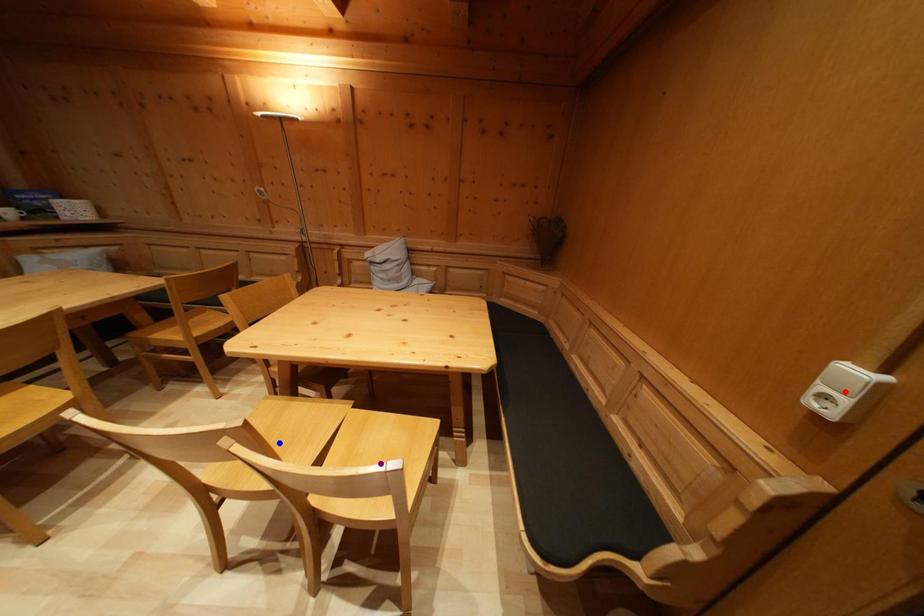
Order these from nearest to farthest:
red point | purple point | blue point

red point, purple point, blue point